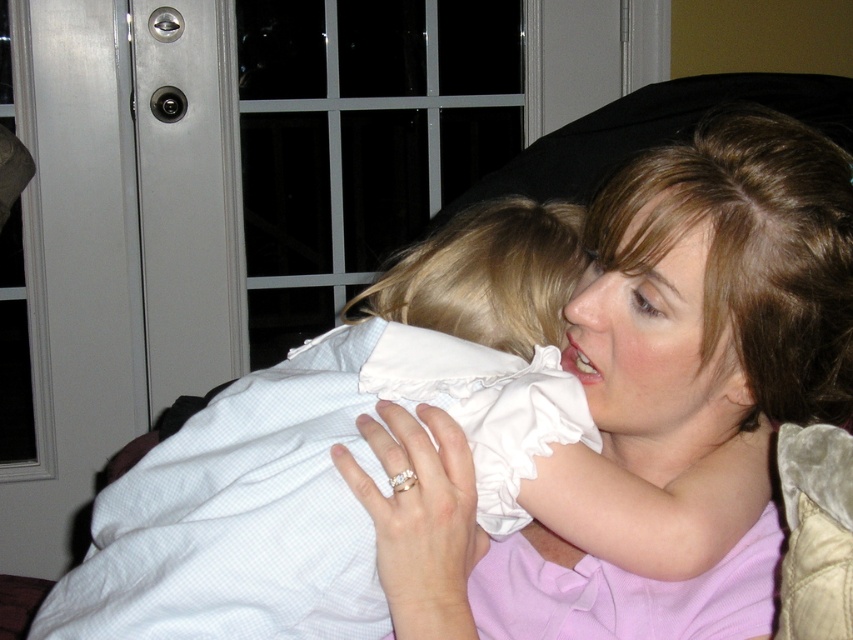
Which is in front, point (521, 577) or point (201, 636)?

Point (201, 636) is in front.

Is the position of matte white shirt at center less distant than that of white cotton dress at center?

No, it is not.

Measure the distance between matte white shirt at center and camera.

26.24 inches

Find the location of a particular element. matte white shirt at center is located at coordinates (717, 291).